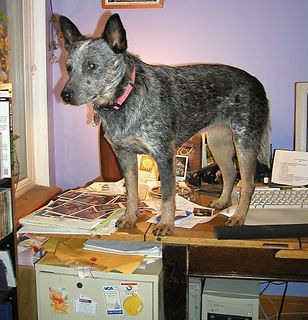
Locate an element on the screen. This screenshot has height=320, width=308. door frame is located at coordinates (36, 135).